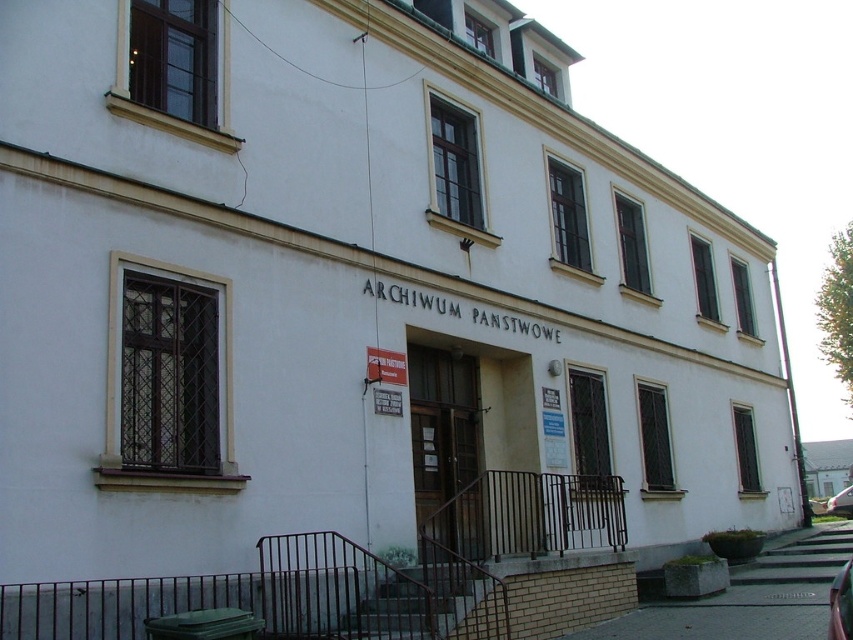
You are a delivery person driving a truck that is 2 meters wide. You need to park your truck between the shiny red car at center and the metallic silver car at lower right. Can you fit your truck in the space between them?

The shiny red car at center is positioned on the left side of metallic silver car at lower right. Since the truck is 2 meters wide, you need to check the distance between the two cars. However, the exact distance isn not provided in the description. Therefore, it is uncertain if the truck can fit between them without additional information.

You are standing at the entrance of the building and want to reach the point marked as point (x=849, y=566). Can you estimate how far you need to walk from the entrance to reach that point?

The distance between point (x=849, y=566) and the viewer is 70.88 feet, so you need to walk approximately 70.88 feet from the entrance to reach that point.